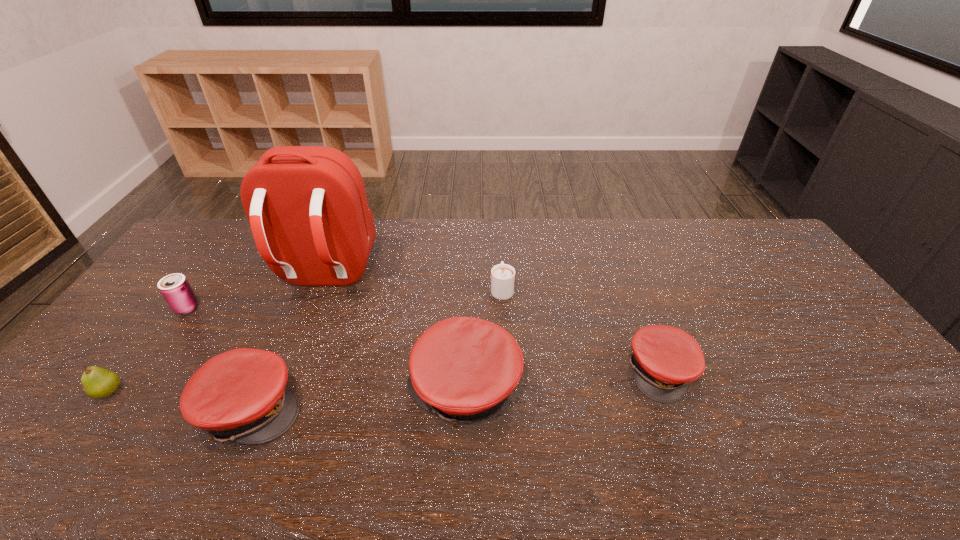
Identify the location of object located at the far edge. (307, 207).

Find the location of a particular element. The image size is (960, 540). pear situated at the near edge is located at coordinates (98, 383).

Locate an element on the screen. The width and height of the screenshot is (960, 540). can positioned at the left edge is located at coordinates (175, 288).

I want to click on pear at the left edge, so click(x=98, y=383).

This screenshot has height=540, width=960. In order to click on object at the near left corner in this screenshot , I will do `click(98, 383)`.

Identify the location of vacant space at the far edge of the desktop. (644, 224).

You are a GUI agent. You are given a task and a screenshot of the screen. Output one action in this format:
    pyautogui.click(x=<x>, y=<y>)
    Task: Click on the vacant region at the near edge of the desktop
    The height and width of the screenshot is (540, 960).
    Given the screenshot: What is the action you would take?
    pyautogui.click(x=546, y=406)

Where is `blank space at the left edge of the desktop`? blank space at the left edge of the desktop is located at coordinates [x=191, y=271].

This screenshot has width=960, height=540. In the image, there is a desktop. Identify the location of vacant space at the right edge. (816, 356).

Locate an element on the screen. The width and height of the screenshot is (960, 540). vacant space at the far left corner of the desktop is located at coordinates (214, 220).